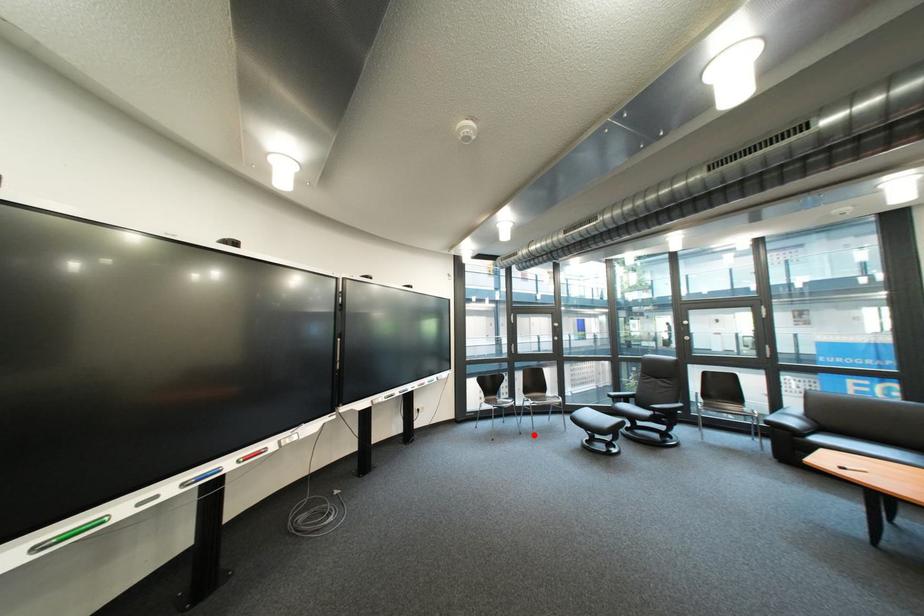
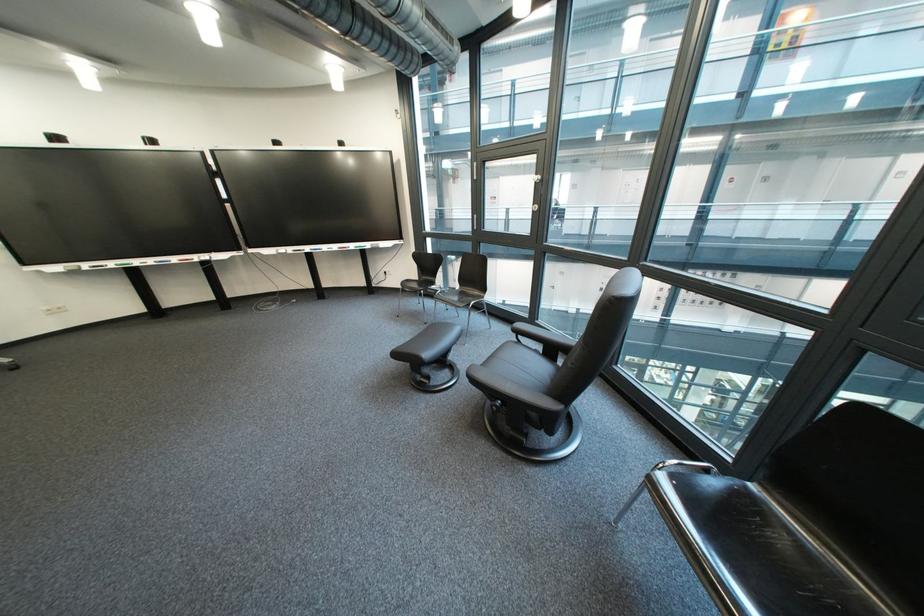
The point at the highlighted location is marked in the first image. Where is the corresponding point in the second image?

(439, 325)